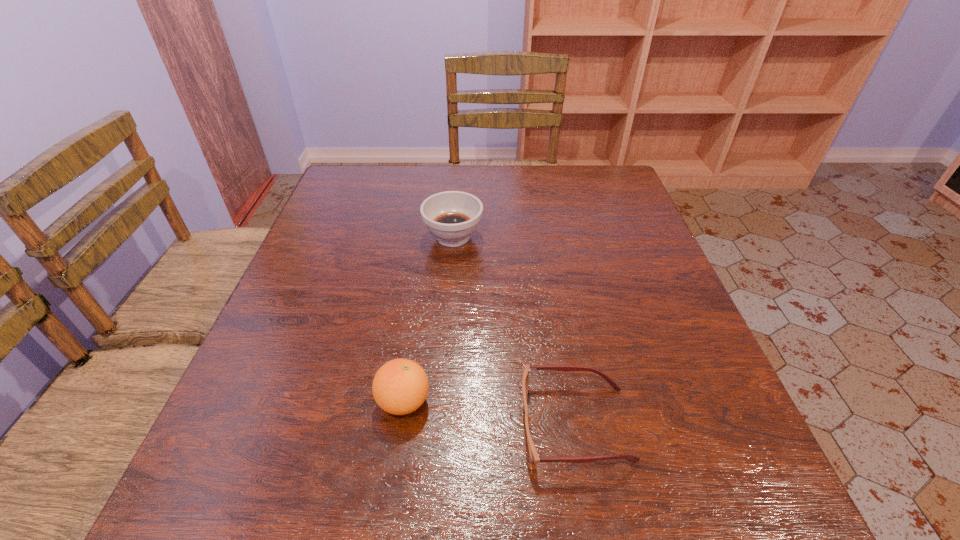
Where is `vacant area at the far edge`? The width and height of the screenshot is (960, 540). vacant area at the far edge is located at coordinates (536, 208).

Where is `vacant space at the near edge of the desktop`? The height and width of the screenshot is (540, 960). vacant space at the near edge of the desktop is located at coordinates (325, 467).

Find the location of a particular element. blank space at the left edge is located at coordinates (318, 219).

In the image, there is a desktop. At what (x,y) coordinates should I click in order to perform the action: click on vacant space at the right edge. Please return your answer as a coordinate pair (x, y). The height and width of the screenshot is (540, 960). Looking at the image, I should click on (592, 214).

The image size is (960, 540). In order to click on vacant space at the far left corner of the desktop in this screenshot , I will do `click(381, 208)`.

The width and height of the screenshot is (960, 540). I want to click on free location at the near left corner of the desktop, so click(x=295, y=475).

In the image, there is a desktop. Where is `blank space at the far right corner`? The height and width of the screenshot is (540, 960). blank space at the far right corner is located at coordinates (593, 168).

Where is `free space at the near right corner of the desktop`? This screenshot has height=540, width=960. free space at the near right corner of the desktop is located at coordinates (769, 514).

Locate an element on the screen. Image resolution: width=960 pixels, height=540 pixels. vacant space in between the orange and the spectacles is located at coordinates (490, 413).

The width and height of the screenshot is (960, 540). What are the coordinates of `unoccupied area between the soup bowl and the orange` in the screenshot? It's located at (428, 319).